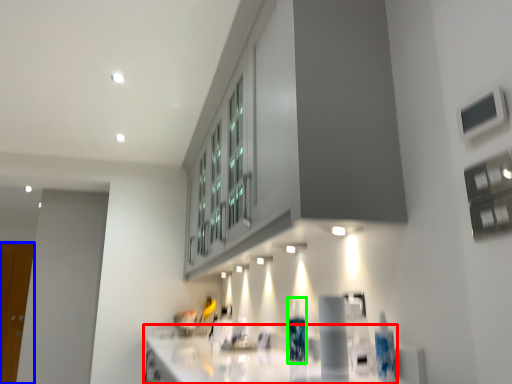
Question: Based on their relative distances, which object is farther from countertop (highlighted by a red box)? Choose from glass door (highlighted by a blue box) and bottle (highlighted by a green box).

Choices:
 (A) glass door
 (B) bottle

Answer: (A)